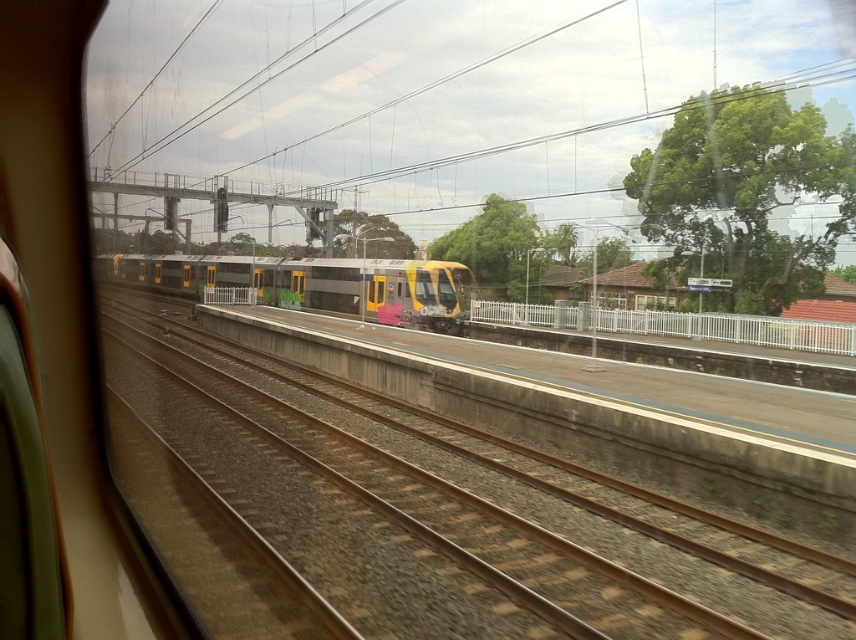
You are a passenger sitting inside the train and looking out the window. You see the metallic gray train at center and the white metal fence at right. Which object appears larger in your view?

The metallic gray train at center appears larger than the white metal fence at right because it is closer to you.

You are sitting in the train looking out the window. There is a point marked at coordinates (468,513) on your window. What object does this point correspond to?

The point at coordinates (468,513) corresponds to the brown gravel track at center.

You are sitting on the train and looking out the window. There are two points marked on the scene. One is at coordinate point [429,451] and the other at point [354,275]. Which point is closer to you?

Point [429,451] is closer to you than point [354,275].